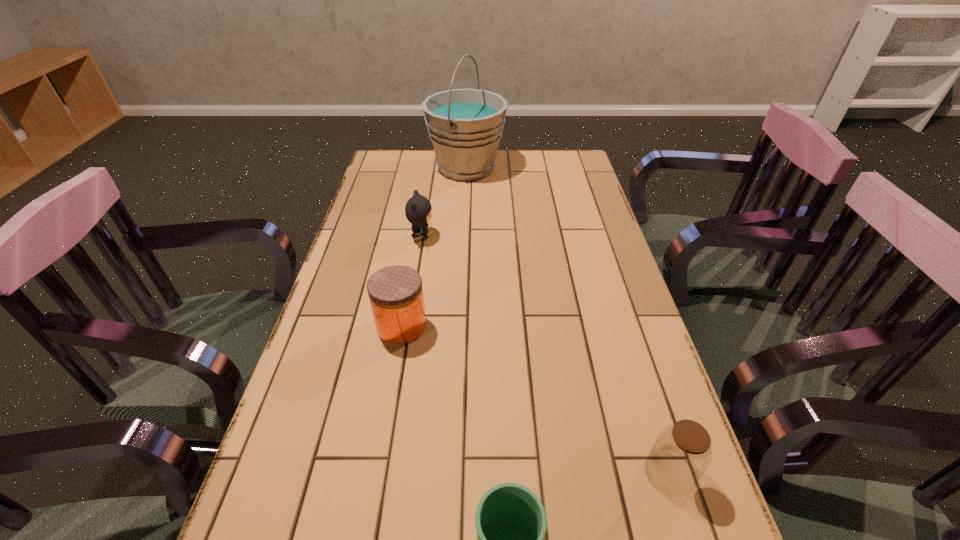
You are a GUI agent. You are given a task and a screenshot of the screen. Output one action in this format:
    pyautogui.click(x=<x>, y=<y>)
    Task: Click on the fourth closest object relative to the nearest object
    This screenshot has width=960, height=540.
    Given the screenshot: What is the action you would take?
    pyautogui.click(x=465, y=126)

At what (x,y) coordinates should I click in order to perform the action: click on object that stands as the second closest to the kitten. Please return your answer as a coordinate pair (x, y). This screenshot has height=540, width=960. Looking at the image, I should click on (396, 295).

Where is `vacant region that satisfies the following two spatial constraints: 1. on the front side of the fourth farthest object; 2. on the right side of the tallest object`? This screenshot has height=540, width=960. vacant region that satisfies the following two spatial constraints: 1. on the front side of the fourth farthest object; 2. on the right side of the tallest object is located at coordinates (451, 474).